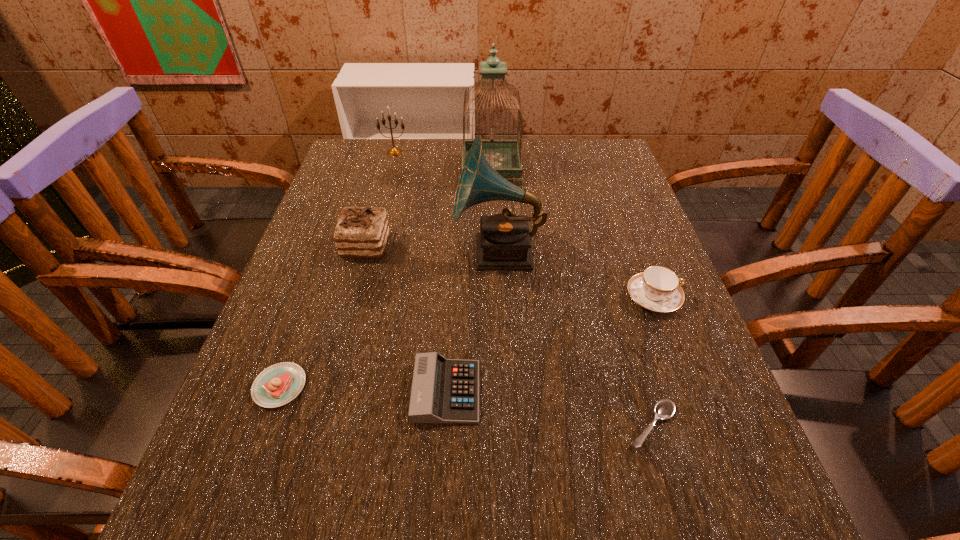
Identify the location of birdcage. The width and height of the screenshot is (960, 540). (504, 156).

You are a GUI agent. You are given a task and a screenshot of the screen. Output one action in this format:
    pyautogui.click(x=<x>, y=<y>)
    Task: Click on the second tallest object
    The width and height of the screenshot is (960, 540).
    Given the screenshot: What is the action you would take?
    pyautogui.click(x=504, y=242)

Locate an element on the screen. This screenshot has height=540, width=960. candelabrum is located at coordinates (393, 151).

The image size is (960, 540). Identify the location of the fifth shortest object. (362, 232).

In order to click on teacup in this screenshot , I will do `click(657, 289)`.

This screenshot has width=960, height=540. Find the location of `the sixth tallest object`. the sixth tallest object is located at coordinates (444, 391).

You are a GUI agent. You are given a task and a screenshot of the screen. Output one action in this format:
    pyautogui.click(x=<x>, y=<y>)
    Task: Click on the second shortest object
    The height and width of the screenshot is (540, 960).
    Given the screenshot: What is the action you would take?
    pyautogui.click(x=277, y=385)

This screenshot has width=960, height=540. In order to click on the shortest object in this screenshot , I will do `click(664, 409)`.

The image size is (960, 540). I want to click on vacant space positioned 0.310m at the door of the tallest object, so click(x=351, y=169).

Find the location of a particular element. Image resolution: width=960 pixels, height=540 pixels. free space located 0.290m at the door of the tallest object is located at coordinates (358, 169).